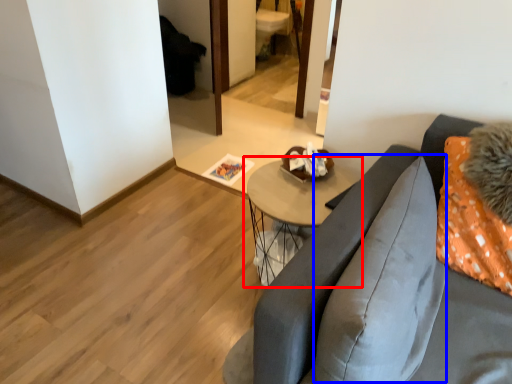
Question: Which of the following is the farthest to the observer, table (highlighted by a red box) or pillow (highlighted by a blue box)?

Choices:
 (A) table
 (B) pillow

Answer: (A)